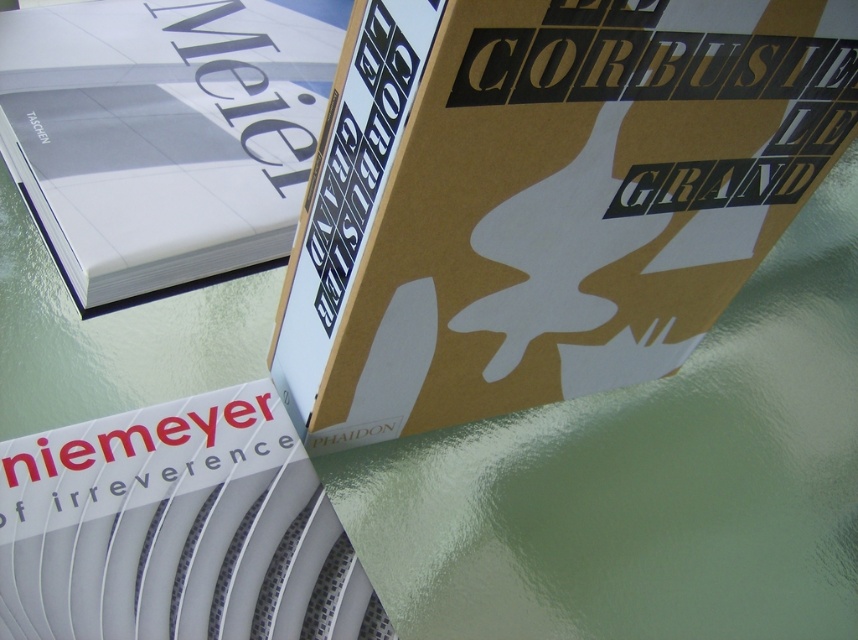
Question: Does matte white book at upper left appear on the right side of white matte book at center?

Choices:
 (A) no
 (B) yes

Answer: (A)

Question: Can you confirm if gold matte book at upper right is smaller than white matte book at center?

Choices:
 (A) yes
 (B) no

Answer: (B)

Question: Which point is closer to the camera?

Choices:
 (A) matte white book at upper left
 (B) gold matte book at upper right

Answer: (B)

Question: Estimate the real-world distances between objects in this image. Which object is closer to the white matte book at center?

Choices:
 (A) gold matte book at upper right
 (B) matte white book at upper left

Answer: (A)

Question: Which of these objects is positioned farthest from the white matte book at center?

Choices:
 (A) matte white book at upper left
 (B) gold matte book at upper right

Answer: (A)

Question: Where is matte white book at upper left located in relation to white matte book at center in the image?

Choices:
 (A) right
 (B) left

Answer: (B)